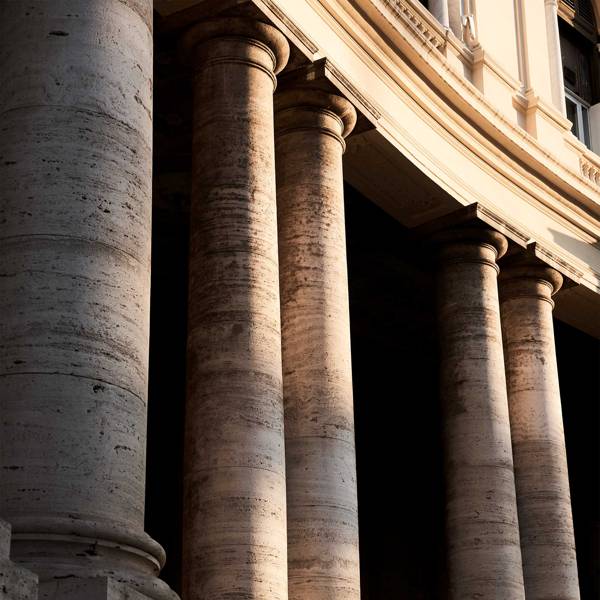
Locate an element on the screen. This screenshot has height=600, width=600. floor of balconies is located at coordinates (364, 57).